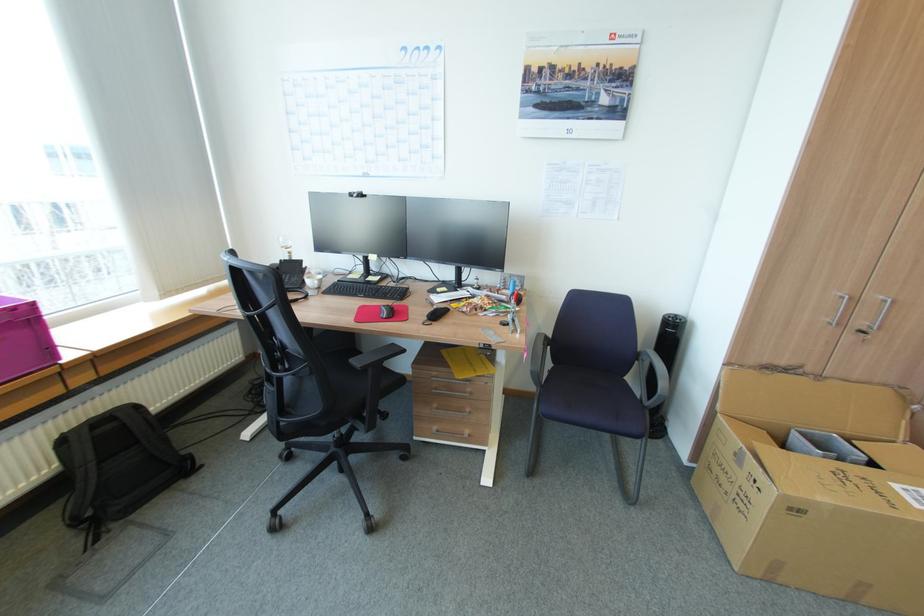
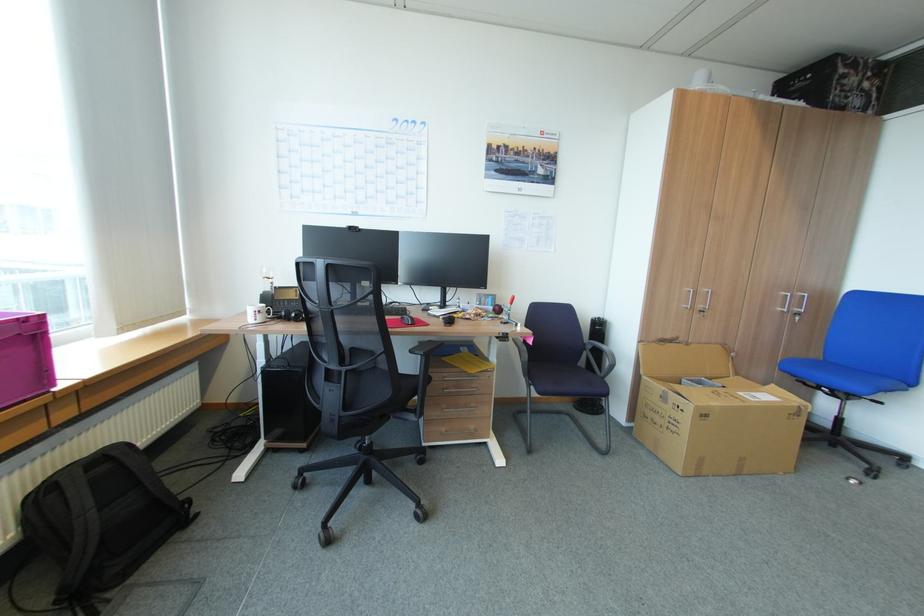
Find the pixel in the second image that matches [643,350] in the first image.

(590, 342)